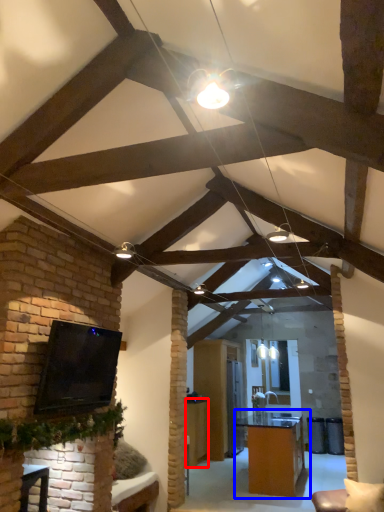
Question: Which of the following is the farthest to the observer, table (highlighted by a red box) or table (highlighted by a blue box)?

Choices:
 (A) table
 (B) table

Answer: (A)